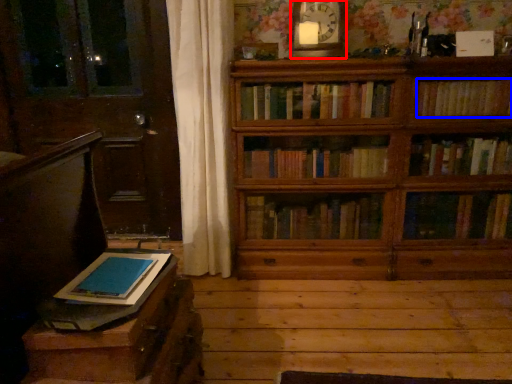
Question: Which object is further to the camera taking this photo, clock (highlighted by a red box) or book (highlighted by a blue box)?

Choices:
 (A) clock
 (B) book

Answer: (B)